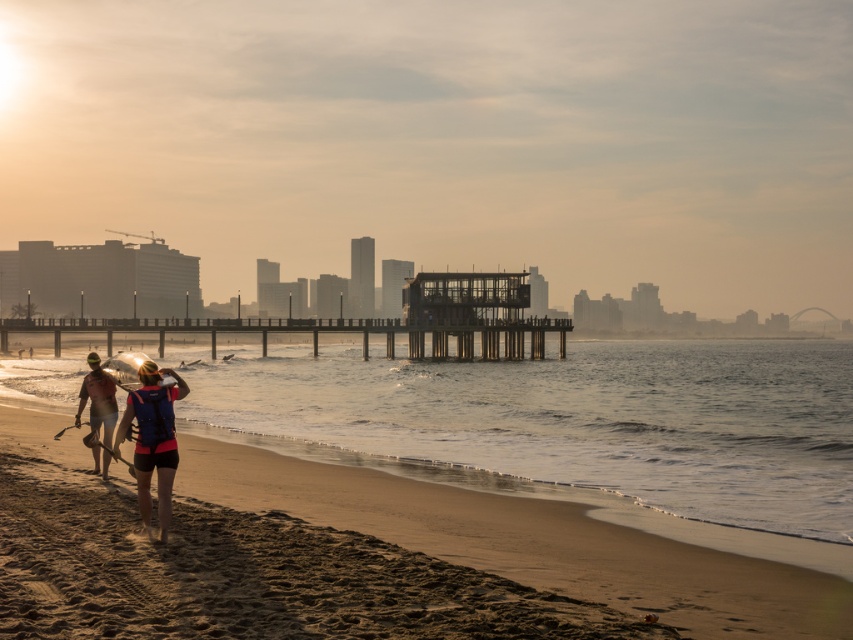
You are planning to set up a small tent for a beachside event. Given the space available on the sandy beach at lower left and the wooden pier at center, which location would be more suitable for accommodating the tent based on their sizes?

The wooden pier at center is larger than the sandy beach at lower left, so the wooden pier at center would be more suitable for accommodating the tent.

Looking at this image, you are standing at the point with coordinates point (138, 497) and want to walk towards the wooden pier in the middle ground. Is the point point (248, 492) in front of or behind you as you face the pier?

The point point (248, 492) is behind point (138, 497), so it would be behind you as you face the pier.